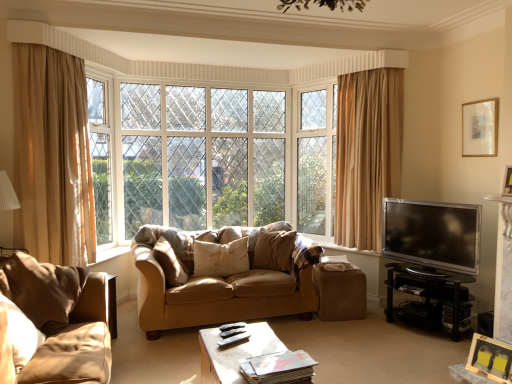
What are the coordinates of `free space above wooden coffee table at center, arranged as the second table when viewed from the right (from a real-world perspective)` in the screenshot? It's located at (246, 344).